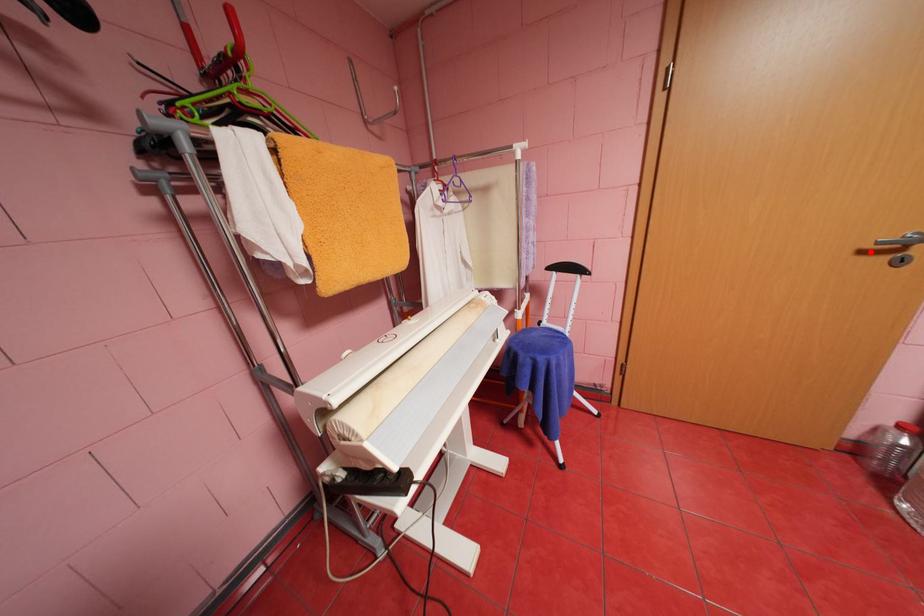
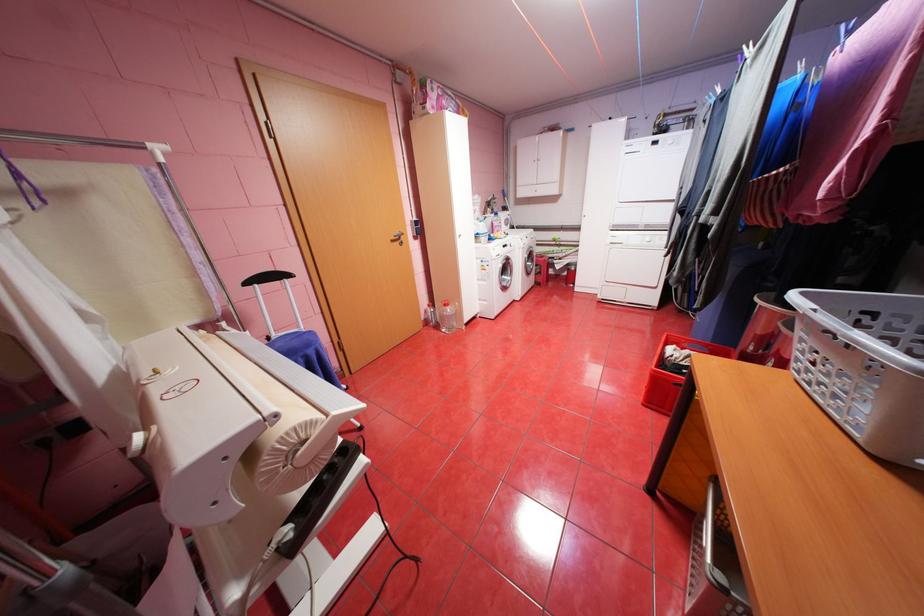
Find the pixel in the second image that matches the highlighted location in the first image.

(400, 241)